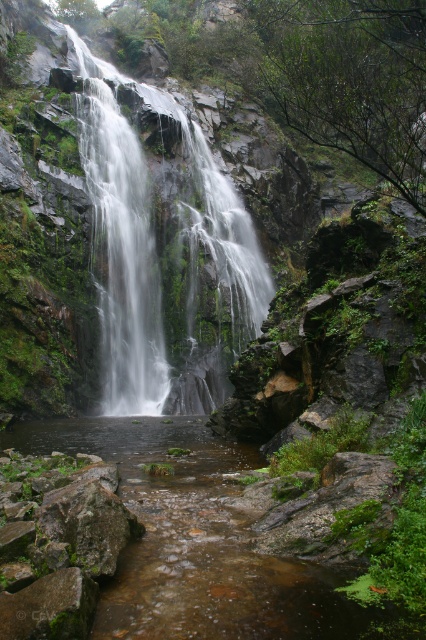
Describe the element at coordinates (201, 545) in the screenshot. I see `clear water stream at center` at that location.

Is clear water stream at center bigger than clear water at center?

No, clear water stream at center is not bigger than clear water at center.

Which is behind, point (363, 625) or point (192, 298)?

The point (192, 298) is more distant.

Locate an element on the screen. The image size is (426, 640). clear water stream at center is located at coordinates [x=201, y=545].